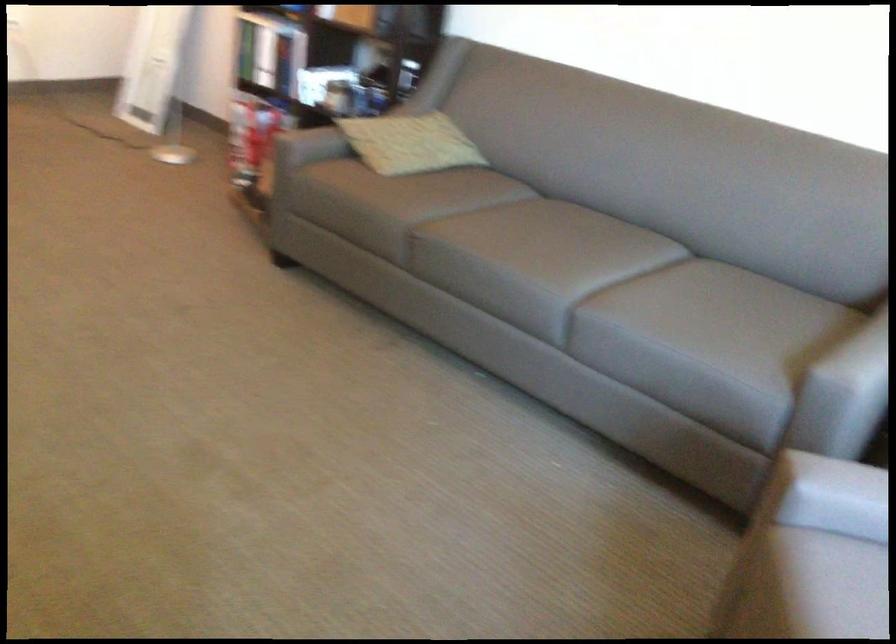
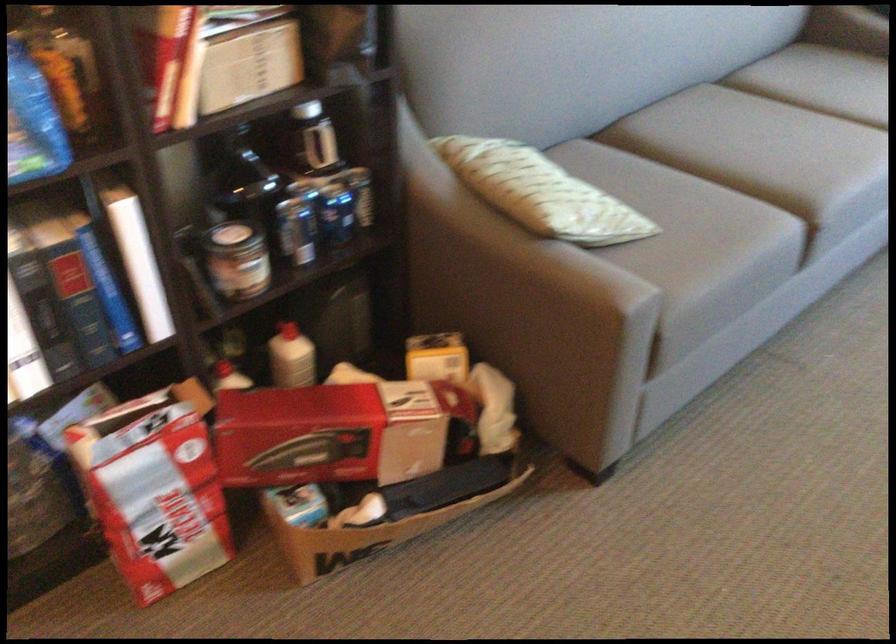
Where in the second image is the point corresponding to (357,116) from the first image?

(537, 192)